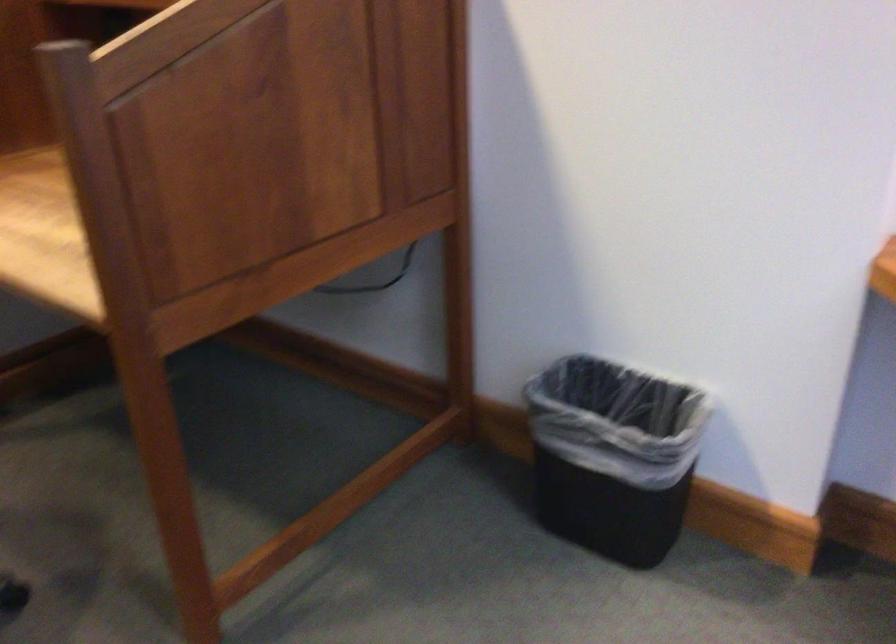
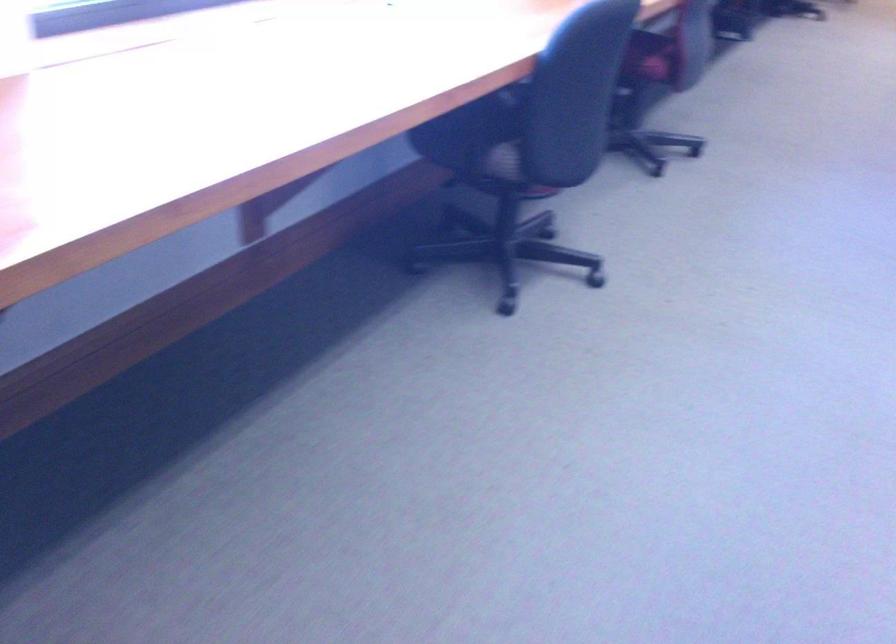
How did the camera likely rotate?

The rotation direction of the camera is right-down.